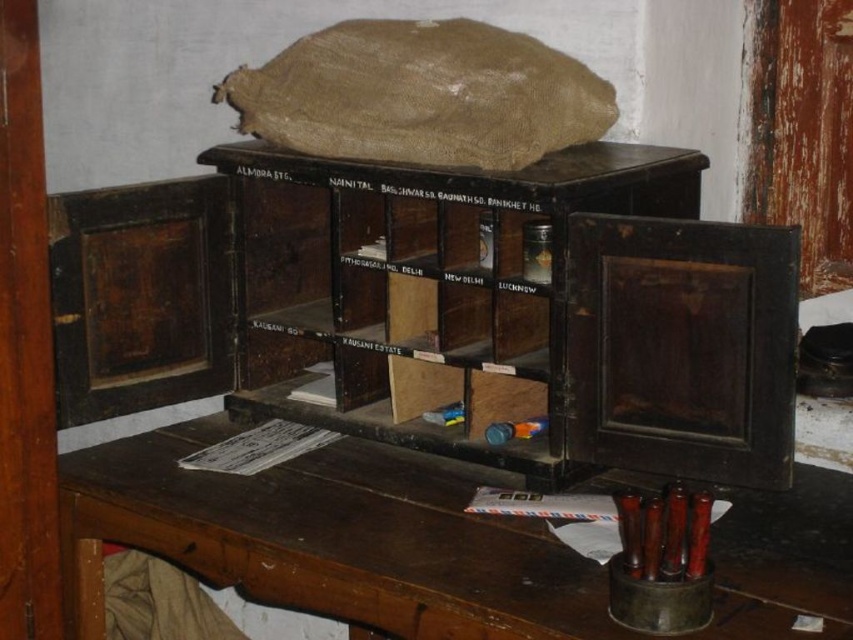
This screenshot has width=853, height=640. In order to click on wooden table at center in this screenshot , I will do point(329,538).

Which is more to the right, wooden table at center or dark wood bookshelf at center?

Positioned to the right is dark wood bookshelf at center.

Is point (271, 596) positioned in front of point (683, 189)?

Yes, it is.

At what (x,y) coordinates should I click in order to perform the action: click on wooden table at center. Please return your answer as a coordinate pair (x, y). Looking at the image, I should click on pos(329,538).